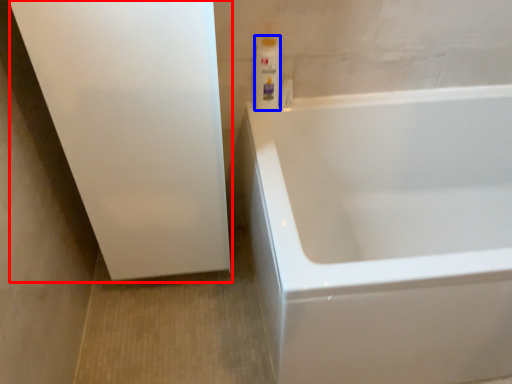
Question: Among these objects, which one is nearest to the camera, screen door (highlighted by a red box) or cleaning product (highlighted by a blue box)?

Choices:
 (A) screen door
 (B) cleaning product

Answer: (A)